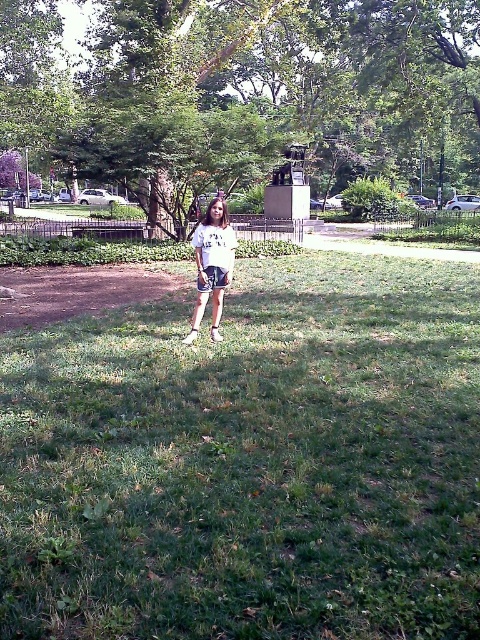
Which is behind, point (455, 499) or point (216, 259)?

Positioned behind is point (216, 259).

How far apart are green grassy field at center and white cotton shirt at center?

green grassy field at center and white cotton shirt at center are 26.16 inches apart.

Between point (371, 268) and point (195, 308), which one is positioned behind?

The point (371, 268) is behind.

Where is `green grassy field at center`? The image size is (480, 640). green grassy field at center is located at coordinates (250, 461).